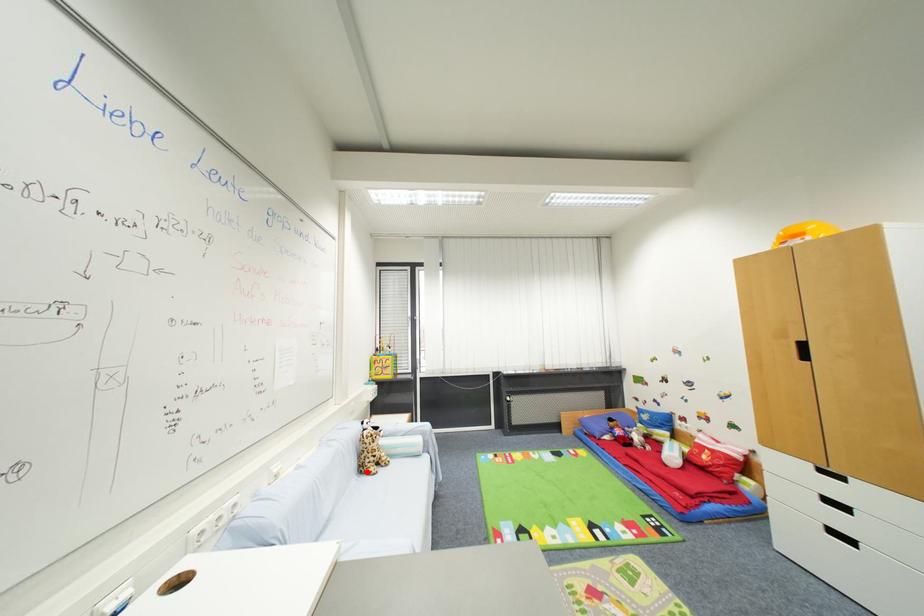
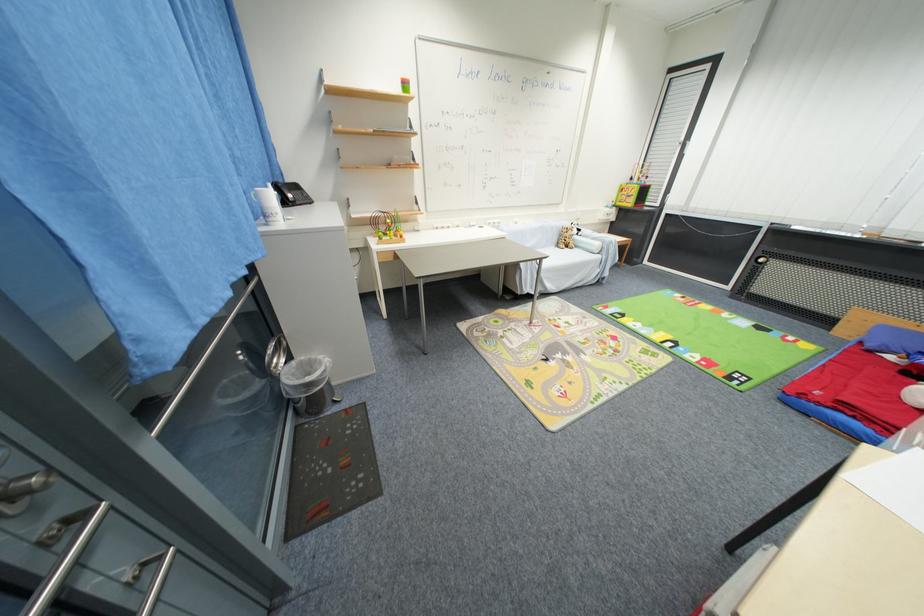
Where in the second image is the point corresponding to the highlighted location from the first image?

(563, 246)